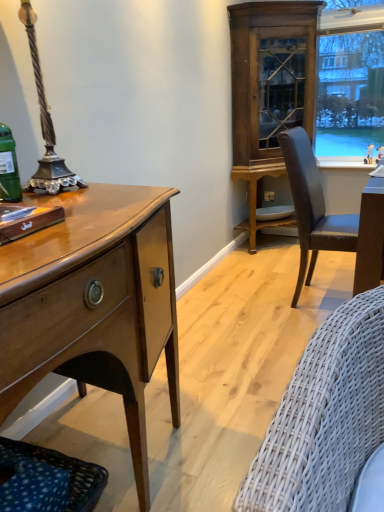
This screenshot has height=512, width=384. What do you see at coordinates (47, 480) in the screenshot? I see `dark blue woven fabric couch at lower left` at bounding box center [47, 480].

The image size is (384, 512). In order to click on white glossy plate at lower center in this screenshot , I will do click(x=274, y=212).

What do you see at coordinates (269, 196) in the screenshot? I see `matte plastic power outlet at lower center` at bounding box center [269, 196].

Where is `shiny brown desk at left`? Image resolution: width=384 pixels, height=512 pixels. shiny brown desk at left is located at coordinates (94, 304).

Considering the sizes of white glossy plate at lower center and matte plastic power outlet at lower center in the image, is white glossy plate at lower center taller or shorter than matte plastic power outlet at lower center?

Considering their sizes, white glossy plate at lower center has less height than matte plastic power outlet at lower center.

Is white glossy plate at lower center not close to matte plastic power outlet at lower center?

They are positioned close to each other.

Between white glossy plate at lower center and matte plastic power outlet at lower center, which one has smaller width?

matte plastic power outlet at lower center is thinner.

Does point (259, 216) lie behind point (272, 193)?

No, it is not.

Is dark blue woven fabric couch at lower left located outside shiny brown desk at left?

No, dark blue woven fabric couch at lower left is not outside of shiny brown desk at left.

Consider the image. Is dark blue woven fabric couch at lower left further to the viewer compared to shiny brown desk at left?

Yes, it is behind shiny brown desk at left.

At what (x,y) coordinates should I click in order to perform the action: click on studio couch behind the shiny brown desk at left. Please return your answer as a coordinate pair (x, y). This screenshot has height=512, width=384. Looking at the image, I should click on (47, 480).

Is dark blue woven fabric couch at lower left placed right next to shiny brown desk at left?

No, dark blue woven fabric couch at lower left is not next to shiny brown desk at left.

Considering the points (293, 124) and (289, 213), which point is behind, point (293, 124) or point (289, 213)?

The point (289, 213) is more distant.

From a real-world perspective, is wooden cabinet at upper right located higher than white glossy plate at lower center?

Yes, from a real-world perspective, wooden cabinet at upper right is on top of white glossy plate at lower center.

From their relative heights in the image, would you say wooden cabinet at upper right is taller or shorter than white glossy plate at lower center?

wooden cabinet at upper right is taller than white glossy plate at lower center.

Is wooden cabinet at upper right facing away from white glossy plate at lower center?

Yes, white glossy plate at lower center is at the back of wooden cabinet at upper right.

Is matte plastic power outlet at lower center to the right of shiny brown desk at left from the viewer's perspective?

Indeed, matte plastic power outlet at lower center is positioned on the right side of shiny brown desk at left.

Would you say matte plastic power outlet at lower center is inside or outside shiny brown desk at left?

matte plastic power outlet at lower center is not enclosed by shiny brown desk at left.

Considering the sizes of matte plastic power outlet at lower center and shiny brown desk at left in the image, is matte plastic power outlet at lower center bigger or smaller than shiny brown desk at left?

Clearly, matte plastic power outlet at lower center is smaller in size than shiny brown desk at left.

In the scene shown: Does matte plastic power outlet at lower center have a greater height compared to shiny brown desk at left?

Incorrect, the height of matte plastic power outlet at lower center is not larger of that of shiny brown desk at left.

Considering the sizes of white glossy plate at lower center and shiny brown desk at left in the image, is white glossy plate at lower center wider or thinner than shiny brown desk at left?

In the image, white glossy plate at lower center appears to be more narrow than shiny brown desk at left.

Is white glossy plate at lower center turned away from shiny brown desk at left?

No, white glossy plate at lower center is not facing away from shiny brown desk at left.

Considering the sizes of white glossy plate at lower center and shiny brown desk at left in the image, is white glossy plate at lower center bigger or smaller than shiny brown desk at left?

white glossy plate at lower center is smaller than shiny brown desk at left.

Considering the sizes of white glossy plate at lower center and shiny brown desk at left in the image, is white glossy plate at lower center taller or shorter than shiny brown desk at left?

white glossy plate at lower center is shorter than shiny brown desk at left.

Considering the sizes of objects matte plastic power outlet at lower center and wooden cabinet at upper right in the image provided, who is taller, matte plastic power outlet at lower center or wooden cabinet at upper right?

wooden cabinet at upper right.

Is matte plastic power outlet at lower center bigger or smaller than wooden cabinet at upper right?

Considering their sizes, matte plastic power outlet at lower center takes up less space than wooden cabinet at upper right.

Is matte plastic power outlet at lower center beside wooden cabinet at upper right?

No.

Is wooden cabinet at upper right inside or outside of shiny brown desk at left?

wooden cabinet at upper right is not inside shiny brown desk at left, it's outside.

Between wooden cabinet at upper right and shiny brown desk at left, which one appears on the left side from the viewer's perspective?

From the viewer's perspective, shiny brown desk at left appears more on the left side.

In the scene shown: From their relative heights in the image, would you say wooden cabinet at upper right is taller or shorter than shiny brown desk at left?

In the image, wooden cabinet at upper right appears to be taller than shiny brown desk at left.

Image resolution: width=384 pixels, height=512 pixels. Identify the location of power outlet behind the white glossy plate at lower center. (269, 196).

This screenshot has width=384, height=512. Identify the location of desk in front of the dark blue woven fabric couch at lower left. (94, 304).

Consider the image. Looking at the image, which one is located further to matte plastic power outlet at lower center, leather-like chair at right or dark blue woven fabric couch at lower left?

Based on the image, dark blue woven fabric couch at lower left appears to be further to matte plastic power outlet at lower center.

Considering their positions, is white glossy plate at lower center positioned further to shiny brown desk at left than dark blue woven fabric couch at lower left?

Among the two, white glossy plate at lower center is located further to shiny brown desk at left.

Considering their positions, is matte plastic power outlet at lower center positioned further to shiny brown desk at left than leather-like chair at right?

Among the two, matte plastic power outlet at lower center is located further to shiny brown desk at left.

Which object lies nearer to the anchor point wooden cabinet at upper right, white glossy plate at lower center or shiny brown desk at left?

white glossy plate at lower center lies closer to wooden cabinet at upper right than the other object.

Considering their positions, is dark blue woven fabric couch at lower left positioned closer to shiny brown desk at left than matte plastic power outlet at lower center?

dark blue woven fabric couch at lower left.

Which object lies nearer to the anchor point leather-like chair at right, matte plastic power outlet at lower center or dark blue woven fabric couch at lower left?

Based on the image, matte plastic power outlet at lower center appears to be nearer to leather-like chair at right.

Considering their positions, is dark blue woven fabric couch at lower left positioned further to white glossy plate at lower center than leather-like chair at right?

Among the two, dark blue woven fabric couch at lower left is located further to white glossy plate at lower center.

Which object lies further to the anchor point leather-like chair at right, dark blue woven fabric couch at lower left or wooden cabinet at upper right?

The object further to leather-like chair at right is dark blue woven fabric couch at lower left.

Identify the location of cabinetry positioned between shiny brown desk at left and white glossy plate at lower center from near to far. (269, 88).

Where is `plate positioned between leather-like chair at right and matte plastic power outlet at lower center from near to far`? This screenshot has height=512, width=384. plate positioned between leather-like chair at right and matte plastic power outlet at lower center from near to far is located at coordinates (274, 212).

Where is `chair between shiny brown desk at left and white glossy plate at lower center along the z-axis`? Image resolution: width=384 pixels, height=512 pixels. chair between shiny brown desk at left and white glossy plate at lower center along the z-axis is located at coordinates (313, 207).

The image size is (384, 512). I want to click on studio couch positioned between shiny brown desk at left and matte plastic power outlet at lower center from near to far, so click(47, 480).